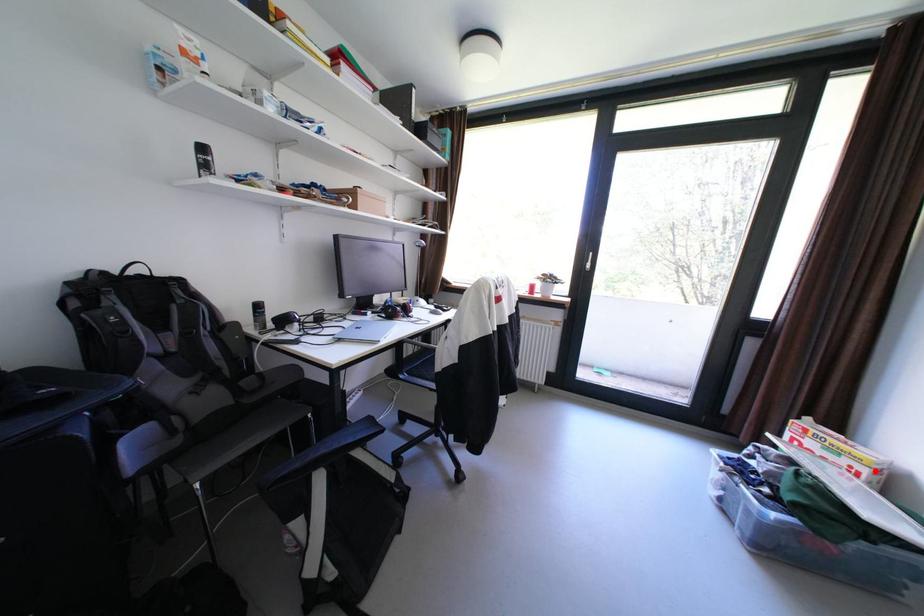
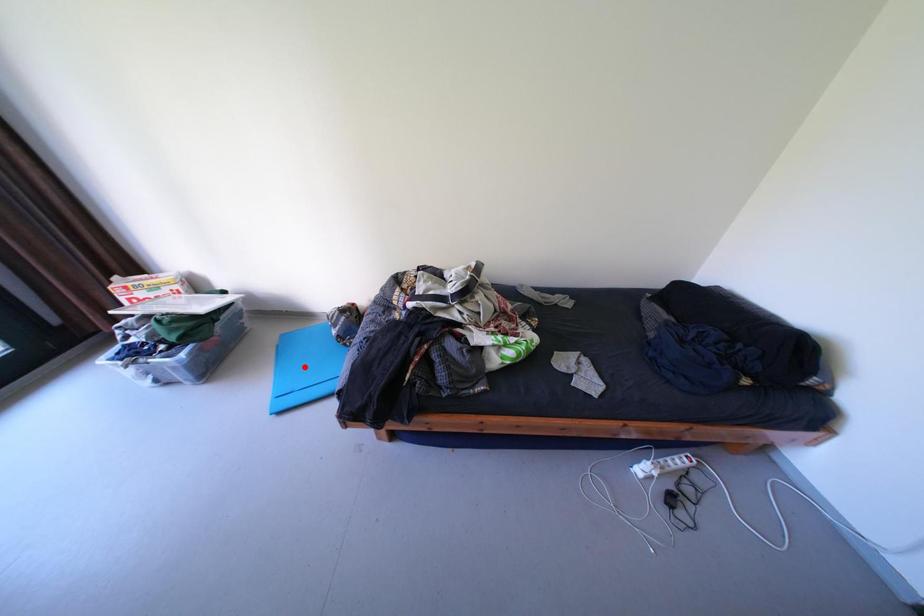
I am providing you with two images of the same scene from different viewpoints. A red point is marked on the first image and another point is marked on the second image. Does the point marked in image1 correspond to the same location as the one in image2?

No